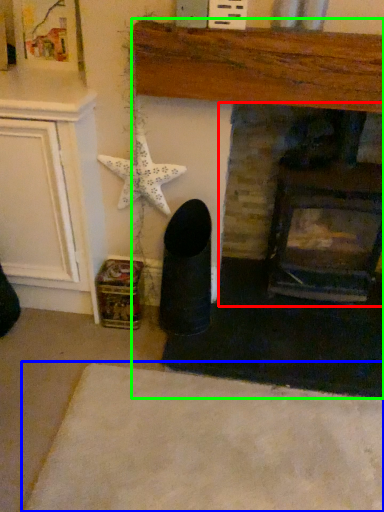
Question: Which is farther away from fireplace (highlighted by a red box)? plain (highlighted by a blue box) or fireplace (highlighted by a green box)?

Choices:
 (A) plain
 (B) fireplace

Answer: (A)